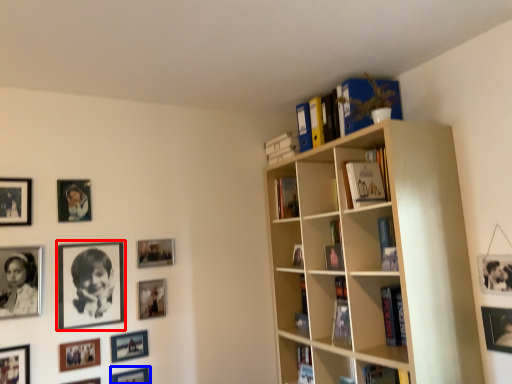
Question: Which object is further to the camera taking this photo, picture frame (highlighted by a red box) or picture frame (highlighted by a blue box)?

Choices:
 (A) picture frame
 (B) picture frame

Answer: (B)